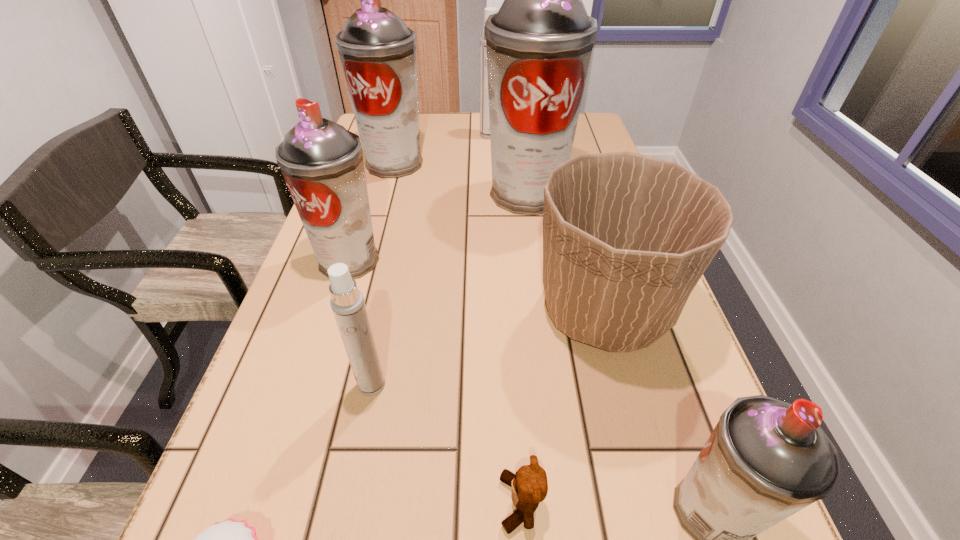
You are a GUI agent. You are given a task and a screenshot of the screen. Output one action in this format:
    pyautogui.click(x=<x>, y=<y>)
    Task: Click on the sixth farthest object
    This screenshot has width=960, height=540.
    Given the screenshot: What is the action you would take?
    pyautogui.click(x=347, y=303)

I want to click on teddy bear, so click(529, 485).

At what (x,y) coordinates should I click in order to perform the action: click on vacant space located 0.230m on the back of the second gray aerosol can from right to left. Please return your answer as a coordinate pair (x, y). The image size is (960, 540). Looking at the image, I should click on (518, 134).

This screenshot has height=540, width=960. What are the coordinates of `vacant region located on the right of the second biggest gray aerosol can` in the screenshot? It's located at (533, 163).

The width and height of the screenshot is (960, 540). In order to click on vacant space located on the back of the second smallest gray aerosol can in this screenshot , I will do `click(382, 156)`.

This screenshot has width=960, height=540. I want to click on free space located on the front of the bigger white aerosol can, so click(491, 191).

Where is `free location located on the back of the flowerpot`? The height and width of the screenshot is (540, 960). free location located on the back of the flowerpot is located at coordinates (566, 173).

The width and height of the screenshot is (960, 540). In order to click on free space located on the right of the smaller white aerosol can in this screenshot , I will do `click(525, 385)`.

Find the location of a particular element. The image size is (960, 540). free region located 0.080m on the front-facing side of the teddy bear is located at coordinates (443, 503).

Identify the location of free location located on the front-facing side of the teddy bear. (415, 503).